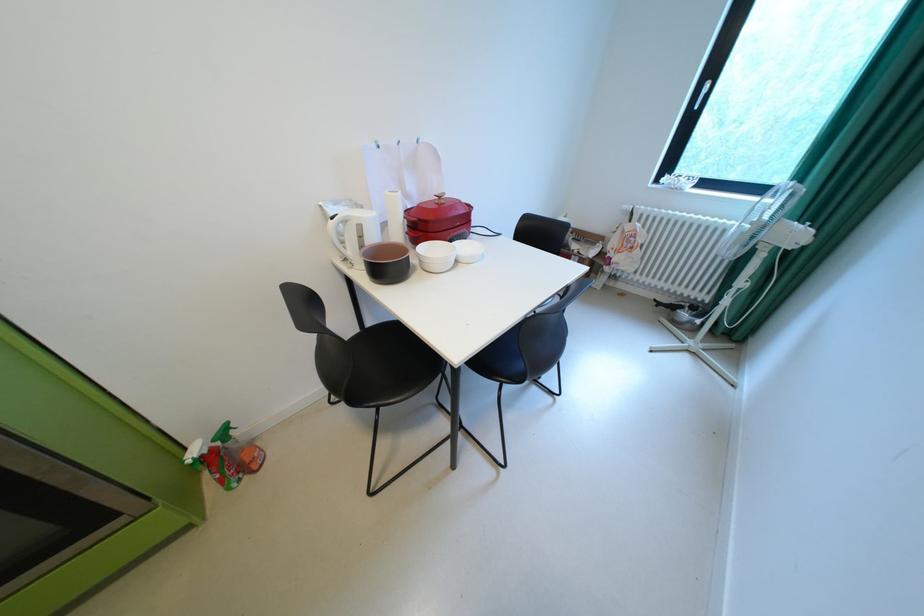
Where would you pull the silver window handle? Please return your answer as a coordinate pair (x, y).

(701, 92)